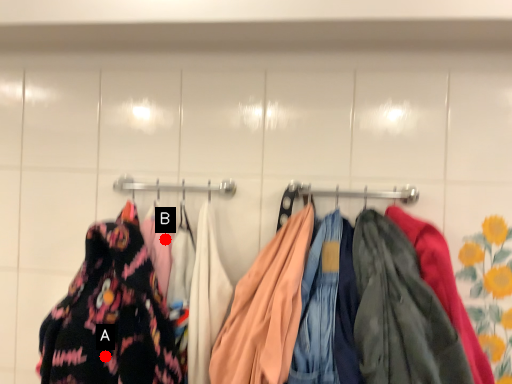
Question: Two points are circled on the image, labeled by A and B beside each circle. Which of the following is the closest to the observer?

Choices:
 (A) A is closer
 (B) B is closer

Answer: (A)